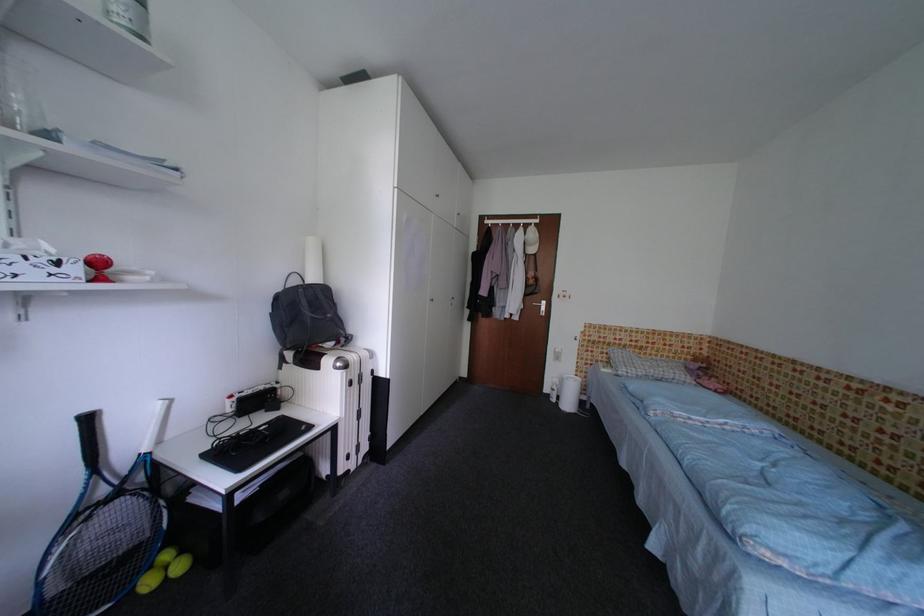
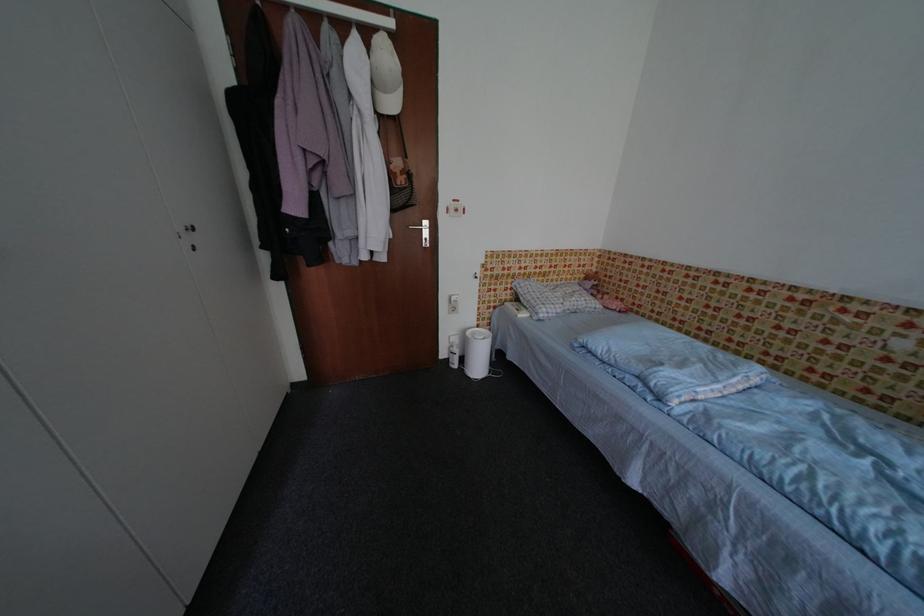
Locate, in the second image, the point that corresponds to point 541,253 in the first image.

(400, 107)